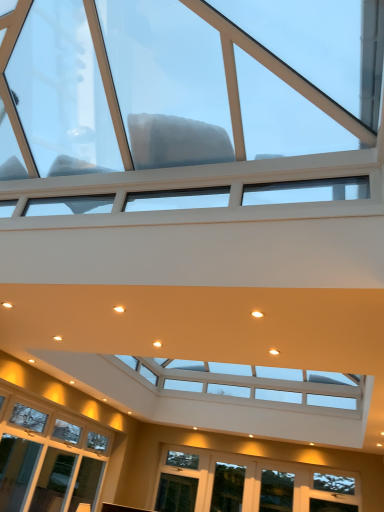
Question: Is clear glass window at lower center, which appears as the second window when viewed from the top, wider than clear glass window at lower center, acting as the first window starting from the bottom?

Choices:
 (A) yes
 (B) no

Answer: (A)

Question: From a real-world perspective, is clear glass window at lower center, which appears as the second window when viewed from the top, on top of clear glass window at lower center, acting as the first window starting from the bottom?

Choices:
 (A) no
 (B) yes

Answer: (B)

Question: Is clear glass window at lower center, which appears as the second window when viewed from the top, looking in the opposite direction of clear glass window at lower center, acting as the first window starting from the bottom?

Choices:
 (A) no
 (B) yes

Answer: (A)

Question: From the image's perspective, is clear glass window at lower center, which appears as the 2th window when ordered from the bottom, on clear glass window at lower center, acting as the first window starting from the bottom?

Choices:
 (A) yes
 (B) no

Answer: (A)

Question: Does clear glass window at lower center, the second window when ordered from back to front, appear on the left side of clear glass window at lower center, acting as the first window starting from the bottom?

Choices:
 (A) yes
 (B) no

Answer: (B)

Question: Relative to transparent glass window at upper center, marked as the 1th window in a front-to-back arrangement, is clear glass window at lower center, arranged as the 1th window when viewed from the back, in front or behind?

Choices:
 (A) behind
 (B) front

Answer: (A)

Question: Looking at the image, does clear glass window at lower center, acting as the first window starting from the bottom, seem bigger or smaller compared to transparent glass window at upper center, marked as the 1th window in a front-to-back arrangement?

Choices:
 (A) big
 (B) small

Answer: (B)

Question: Would you say clear glass window at lower center, which ranks as the third window in front-to-back order, is to the left or to the right of transparent glass window at upper center, the third window from the back, in the picture?

Choices:
 (A) right
 (B) left

Answer: (A)

Question: Is clear glass window at lower center, which appears as the 3th window when viewed from the top, wider or thinner than transparent glass window at upper center, which is counted as the 1th window, starting from the top?

Choices:
 (A) wide
 (B) thin

Answer: (B)

Question: Visually, is transparent glass window at upper center, the third window from the back, positioned to the left or to the right of clear glass window at lower center, the second window when ordered from back to front?

Choices:
 (A) left
 (B) right

Answer: (A)

Question: Is transparent glass window at upper center, which is counted as the third window, starting from the bottom, bigger or smaller than clear glass window at lower center, the second window in the front-to-back sequence?

Choices:
 (A) small
 (B) big

Answer: (B)

Question: Is transparent glass window at upper center, which is counted as the third window, starting from the bottom, wider or thinner than clear glass window at lower center, the second window when ordered from back to front?

Choices:
 (A) wide
 (B) thin

Answer: (A)

Question: From the image's perspective, relative to clear glass window at lower center, the second window in the front-to-back sequence, is transparent glass window at upper center, the third window from the back, above or below?

Choices:
 (A) below
 (B) above

Answer: (B)

Question: In terms of size, does clear glass window at lower center, acting as the first window starting from the bottom, appear bigger or smaller than clear glass window at lower center, the second window when ordered from back to front?

Choices:
 (A) small
 (B) big

Answer: (B)

Question: From the image's perspective, is clear glass window at lower center, arranged as the 1th window when viewed from the back, located above or below clear glass window at lower center, the second window when ordered from back to front?

Choices:
 (A) above
 (B) below

Answer: (B)